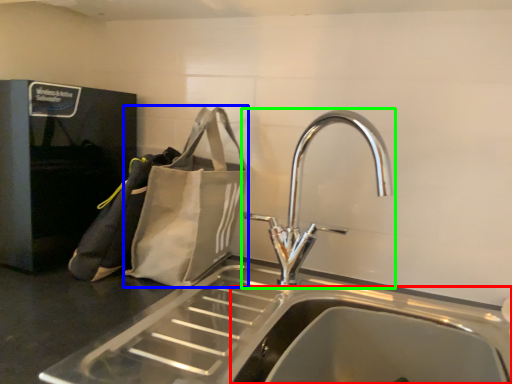
Question: Which is farther away from sink (highlighted by a red box)? pouch (highlighted by a blue box) or tap (highlighted by a green box)?

Choices:
 (A) pouch
 (B) tap

Answer: (A)